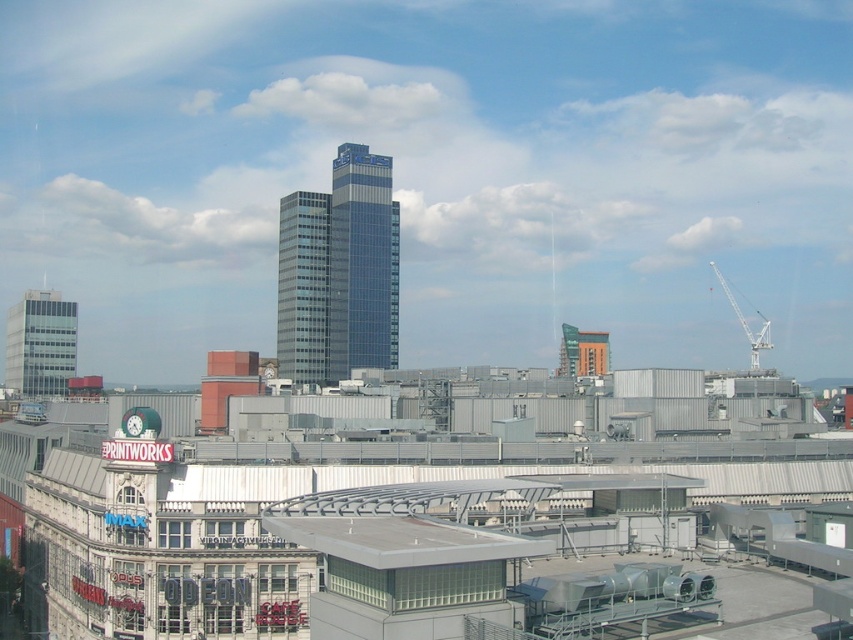
You are standing at the camera position looking at the urban skyline. There is a point at coordinates point [62,355]. Can you determine if this point is within a safe distance for a drone to hover without entering restricted airspace? The restricted airspace starts at 1000 feet from the camera.

The point at [62,355] is 1168.87 feet from the camera, which exceeds the 1000 feet restricted airspace limit. Therefore, the drone can safely hover at this point without entering restricted airspace.

You are a city planner assessing the urban layout. Given the presence of the matte glass building at left and the white metallic crane at upper right, which structure is taller?

The white metallic crane at upper right is taller than the matte glass building at left.

You are a city planner reviewing the urban layout. Based on the image, which object is positioned lower in the scene between the matte glass building at left and the white metallic crane at upper right?

The matte glass building at left is positioned lower than the white metallic crane at upper right in the scene.